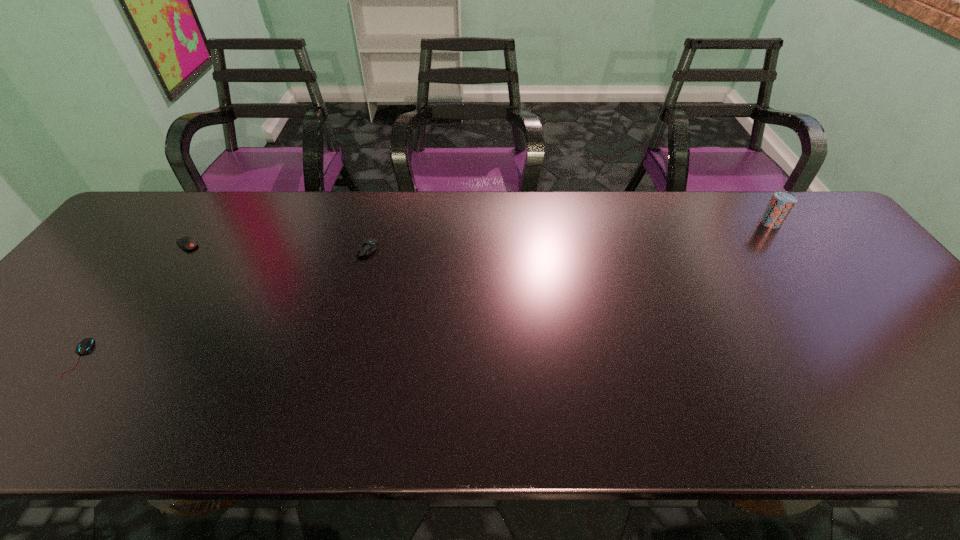
The image size is (960, 540). In order to click on beer can that is positioned at the far edge in this screenshot , I will do `click(779, 207)`.

Where is `object positioned at the left edge`? object positioned at the left edge is located at coordinates (86, 344).

Identify the location of object that is at the right edge. (779, 207).

Where is `object situated at the far right corner`? Image resolution: width=960 pixels, height=540 pixels. object situated at the far right corner is located at coordinates (779, 207).

Where is `vacant region at the far edge of the desktop`? This screenshot has height=540, width=960. vacant region at the far edge of the desktop is located at coordinates (667, 198).

Locate an element on the screen. vacant space at the near edge of the desktop is located at coordinates (620, 409).

This screenshot has width=960, height=540. In the image, there is a desktop. Identify the location of free region at the left edge. (115, 278).

Image resolution: width=960 pixels, height=540 pixels. Find the location of `vacant space at the far right corner of the desktop`. vacant space at the far right corner of the desktop is located at coordinates (838, 239).

This screenshot has width=960, height=540. Find the location of `free space at the near right corner of the desktop`. free space at the near right corner of the desktop is located at coordinates (945, 403).

Locate an element on the screen. The width and height of the screenshot is (960, 540). empty space between the farthest object and the rightmost mouse is located at coordinates (568, 237).